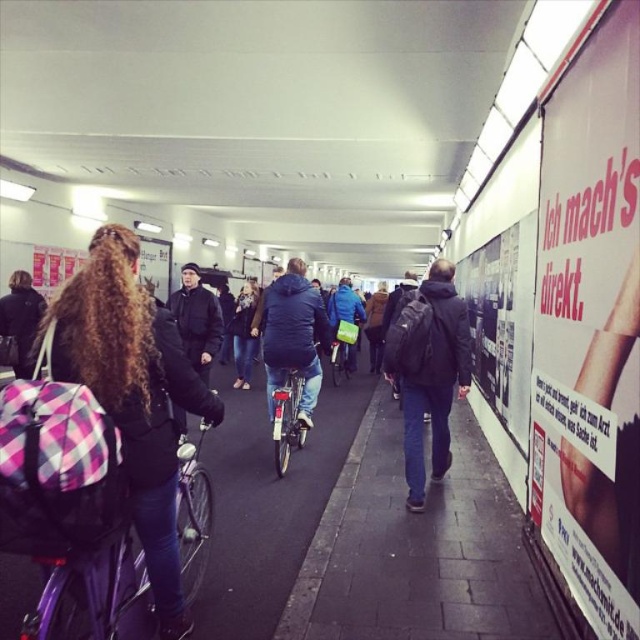
Question: Estimate the real-world distances between objects in this image. Which object is farther from the white paper advertisement at right?

Choices:
 (A) shiny metallic bicycle at center
 (B) plaid backpack at left

Answer: (B)

Question: Considering the real-world distances, which object is farthest from the shiny metallic bicycle at center?

Choices:
 (A) metallic silver bicycle at center
 (B) denim jacket at center

Answer: (A)

Question: Does matte black backpack at center appear on the left side of metallic silver bicycle at center?

Choices:
 (A) no
 (B) yes

Answer: (A)

Question: Does purple matte bicycle at left have a smaller size compared to metallic silver bicycle at center?

Choices:
 (A) yes
 (B) no

Answer: (A)

Question: Which of the following is the closest to the observer?

Choices:
 (A) white paper advertisement at right
 (B) metallic silver bicycle at center
 (C) shiny metallic bicycle at center
 (D) blue fabric jacket at center

Answer: (A)

Question: Is white paper advertisement at right above metallic silver bicycle at center?

Choices:
 (A) no
 (B) yes

Answer: (B)